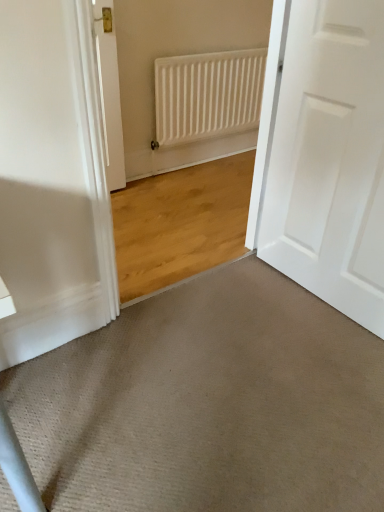
Question: Can we say beige carpet at lower center lies outside white matte door at right?

Choices:
 (A) no
 (B) yes

Answer: (B)

Question: Considering the relative positions of beige carpet at lower center and white matte door at right in the image provided, is beige carpet at lower center to the right of white matte door at right from the viewer's perspective?

Choices:
 (A) no
 (B) yes

Answer: (A)

Question: Is beige carpet at lower center shorter than white matte door at right?

Choices:
 (A) yes
 (B) no

Answer: (A)

Question: Does beige carpet at lower center have a greater height compared to white matte door at right?

Choices:
 (A) yes
 (B) no

Answer: (B)

Question: Is white matte door at right at the back of beige carpet at lower center?

Choices:
 (A) yes
 (B) no

Answer: (B)

Question: Is white matte door at right to the left or to the right of white matte radiator at upper center in the image?

Choices:
 (A) left
 (B) right

Answer: (B)

Question: From the image's perspective, is white matte door at right positioned above or below white matte radiator at upper center?

Choices:
 (A) below
 (B) above

Answer: (A)

Question: Is white matte door at right bigger or smaller than white matte radiator at upper center?

Choices:
 (A) big
 (B) small

Answer: (A)

Question: Is white matte door at right inside the boundaries of white matte radiator at upper center, or outside?

Choices:
 (A) inside
 (B) outside

Answer: (B)

Question: Is white matte door at right bigger or smaller than beige carpet at lower center?

Choices:
 (A) small
 (B) big

Answer: (B)

Question: From the image's perspective, is white matte door at right located above or below beige carpet at lower center?

Choices:
 (A) below
 (B) above

Answer: (B)

Question: From a real-world perspective, is white matte door at right above or below beige carpet at lower center?

Choices:
 (A) above
 (B) below

Answer: (A)

Question: Is white matte door at right inside or outside of beige carpet at lower center?

Choices:
 (A) inside
 (B) outside

Answer: (B)

Question: From the image's perspective, is white matte radiator at upper center above or below beige carpet at lower center?

Choices:
 (A) below
 (B) above

Answer: (B)

Question: Considering the positions of white matte radiator at upper center and beige carpet at lower center in the image, is white matte radiator at upper center bigger or smaller than beige carpet at lower center?

Choices:
 (A) small
 (B) big

Answer: (A)